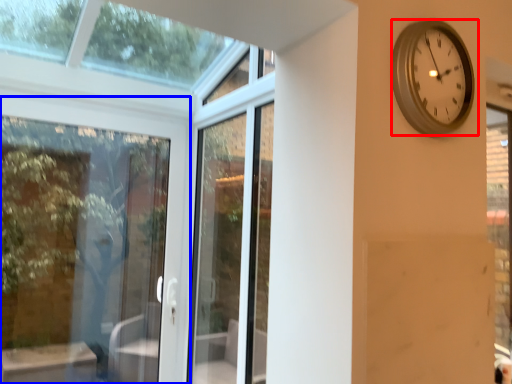
Question: Which object appears closest to the camera in this image, wall clock (highlighted by a red box) or door (highlighted by a blue box)?

Choices:
 (A) wall clock
 (B) door

Answer: (A)